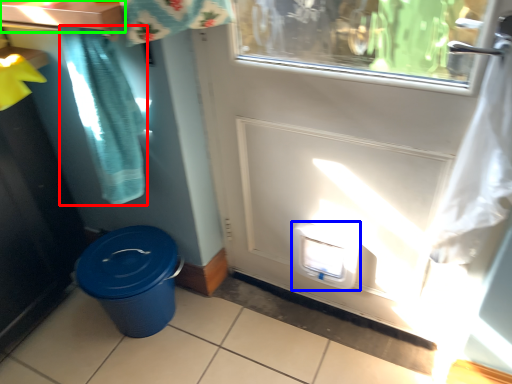
Question: Estimate the real-world distances between objects in this image. Which object is closer to shower curtain (highlighted by a red box), water cooler (highlighted by a blue box) or counter top (highlighted by a green box)?

Choices:
 (A) water cooler
 (B) counter top

Answer: (B)